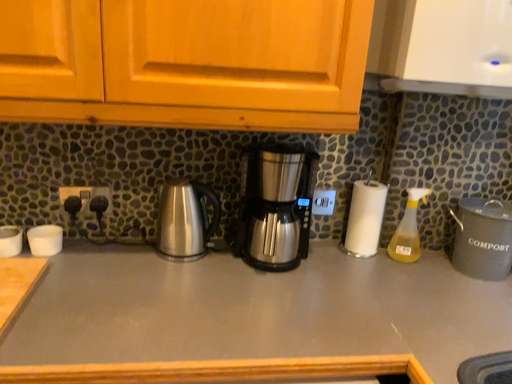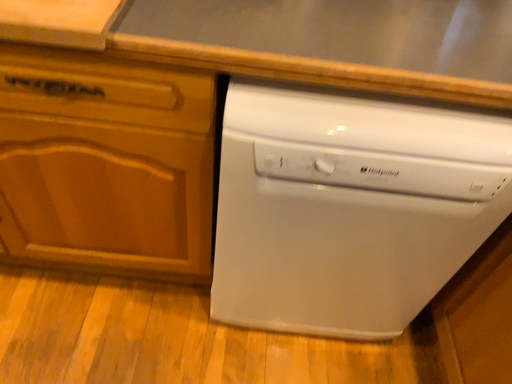
Question: How did the camera likely rotate when shooting the video?

Choices:
 (A) rotated left
 (B) rotated right

Answer: (A)